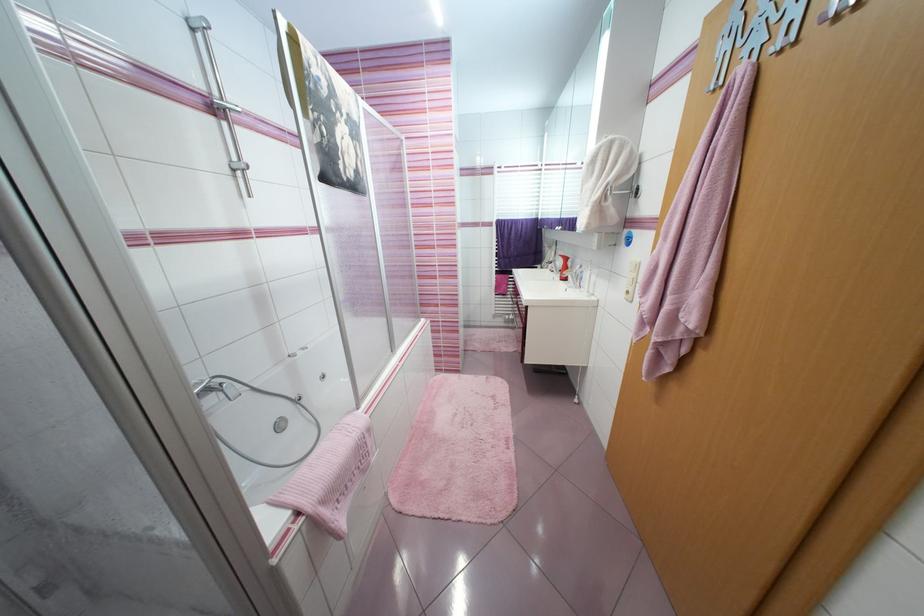
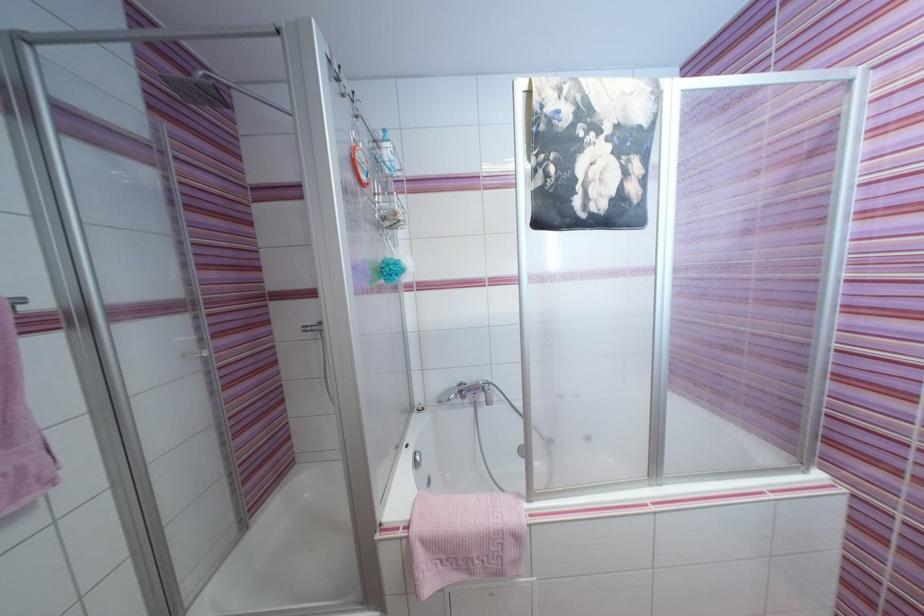
In the second image, find the point that corresponds to pixel 356 176 in the first image.

(604, 208)